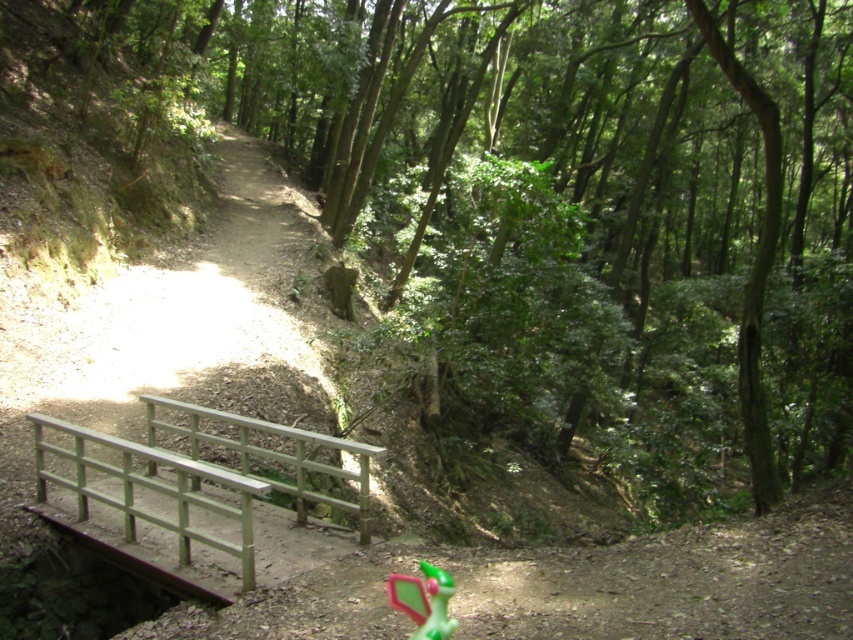
Does wooden bridge at lower left come behind green matte toy at lower center?

That is True.

Does point (64, 472) come farther from viewer compared to point (432, 589)?

Yes.

What do you see at coordinates (202, 404) in the screenshot?
I see `wooden bridge at lower left` at bounding box center [202, 404].

Find the location of a particular element. This screenshot has width=853, height=640. wooden bridge at lower left is located at coordinates (202, 404).

Who is positioned more to the left, wooden bridge at lower left or green painted wood rail at lower center?

Positioned to the left is wooden bridge at lower left.

Is point (183, 467) behind point (141, 483)?

No, (183, 467) is in front of (141, 483).

Identify the location of wooden bridge at lower left. (202, 404).

Is green painted wood rail at lower center closer to the viewer compared to green matte toy at lower center?

No, green painted wood rail at lower center is further to the viewer.

Which of these two, green painted wood rail at lower center or green matte toy at lower center, stands taller?

With more height is green painted wood rail at lower center.

Locate an element on the screen. The image size is (853, 640). green painted wood rail at lower center is located at coordinates (198, 476).